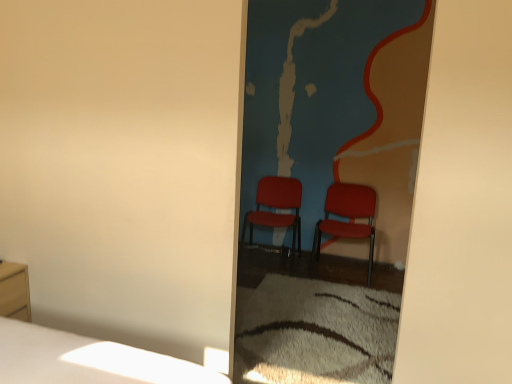
Question: Based on their positions, is matte red chair at center, the second chair from the right, located to the left or right of matte red chairs at center?

Choices:
 (A) left
 (B) right

Answer: (A)

Question: Looking at the image, does matte red chair at center, the second chair from the right, seem bigger or smaller compared to matte red chairs at center?

Choices:
 (A) big
 (B) small

Answer: (A)

Question: Estimate the real-world distances between objects in this image. Which object is farther from the matte red chair at center, the 1th chair from the left?

Choices:
 (A) matte red chairs at center
 (B) matte plastic chair at center, which is the second chair from left to right
 (C) matte wood nightstand at lower left

Answer: (C)

Question: Considering the real-world distances, which object is farthest from the matte plastic chair at center, which is the second chair from left to right?

Choices:
 (A) matte red chair at center, the second chair from the right
 (B) matte wood nightstand at lower left
 (C) matte red chairs at center

Answer: (B)